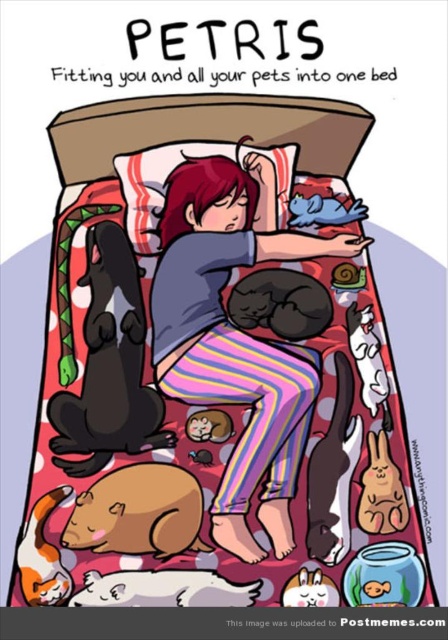
Does matte blue shirt at center have a larger size compared to brown furry hamster at lower left?

Yes, matte blue shirt at center is bigger than brown furry hamster at lower left.

Between matte blue shirt at center and brown furry hamster at lower left, which one has more height?

matte blue shirt at center

Locate an element on the screen. matte blue shirt at center is located at coordinates [x=236, y=337].

Between point (249, 422) and point (84, 324), which one is positioned in front?

Point (249, 422)

Is matte blue shirt at center below black fur dog at lower left?

No.

Is point (249, 440) positioned before point (110, 312)?

Yes.

Find the location of a particular element. The image size is (448, 640). matte blue shirt at center is located at coordinates point(236,337).

Does black fur dog at lower left have a smaller size compared to white fur cat at lower left?

No, black fur dog at lower left is not smaller than white fur cat at lower left.

Can you confirm if black fur dog at lower left is positioned above white fur cat at lower left?

Correct, black fur dog at lower left is located above white fur cat at lower left.

Between point (100, 346) and point (189, 595), which one is positioned in front?

Point (189, 595)

Find the location of `black fur dog at lower left`. black fur dog at lower left is located at coordinates (108, 365).